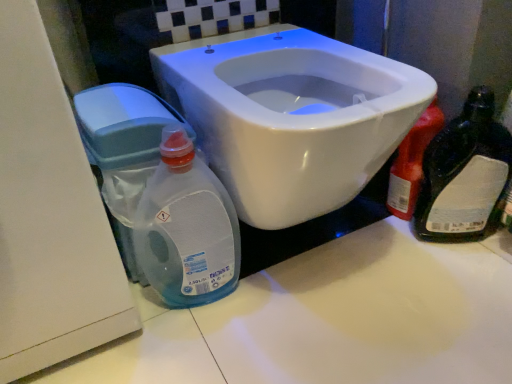
The image size is (512, 384). What are the coordinates of `free area in between transparent plastic bottle at lower left and translucent plastic bottle at right` in the screenshot? It's located at (336, 263).